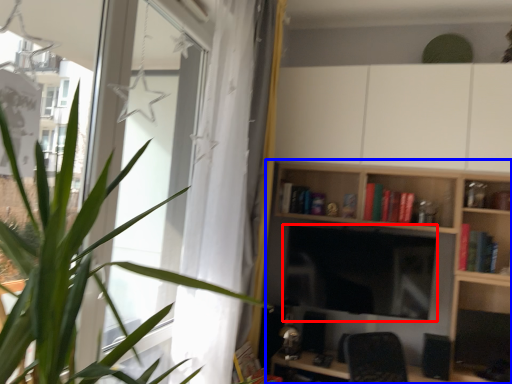
Question: Which point is further to the camera, computer monitor (highlighted by a red box) or shelf (highlighted by a blue box)?

Choices:
 (A) computer monitor
 (B) shelf

Answer: (A)